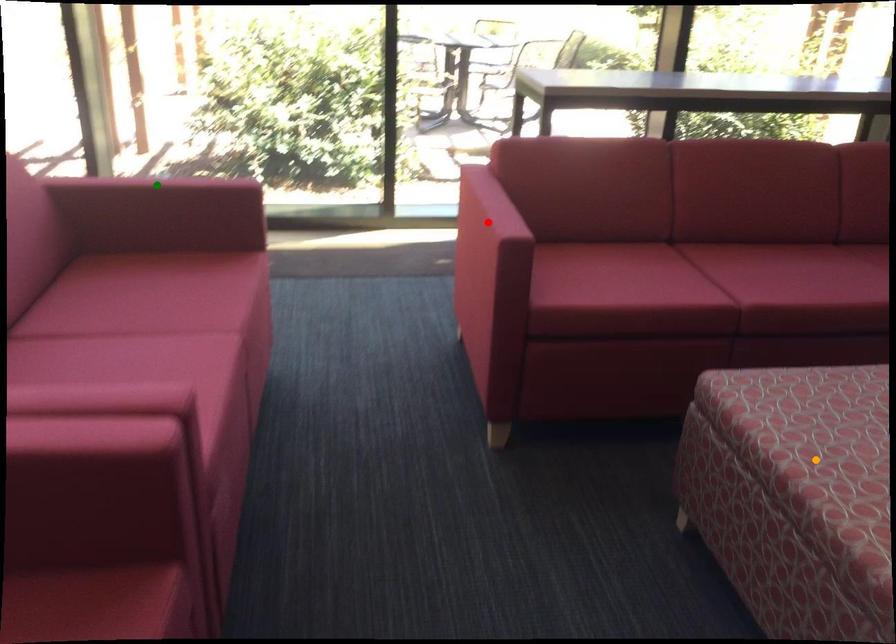
Order these from nearest to farthest:
- green point
- orange point
- red point

orange point < green point < red point